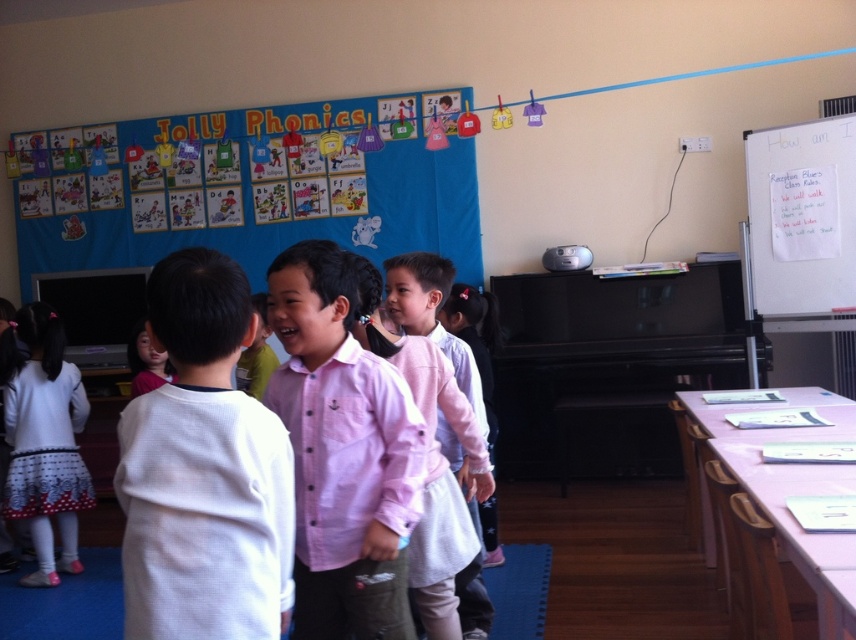
Does pink button-down shirt at center appear over pink cotton shirt at center?

Yes, pink button-down shirt at center is above pink cotton shirt at center.

Between pink button-down shirt at center and pink cotton shirt at center, which one appears on the right side from the viewer's perspective?

pink cotton shirt at center is more to the right.

This screenshot has height=640, width=856. What do you see at coordinates (343, 452) in the screenshot? I see `pink button-down shirt at center` at bounding box center [343, 452].

At what (x,y) coordinates should I click in order to perform the action: click on pink button-down shirt at center. Please return your answer as a coordinate pair (x, y). The width and height of the screenshot is (856, 640). Looking at the image, I should click on (343, 452).

Image resolution: width=856 pixels, height=640 pixels. In order to click on pink button-down shirt at center in this screenshot , I will do `click(343, 452)`.

Which is behind, point (310, 420) or point (842, 218)?

Point (842, 218)

This screenshot has width=856, height=640. In order to click on pink button-down shirt at center in this screenshot , I will do `click(343, 452)`.

Who is taller, white matte shirt at center or white paper at upper right?

Standing taller between the two is white paper at upper right.

Which is behind, point (217, 593) or point (755, 269)?

The point (755, 269) is behind.

Is point (128, 474) closer to viewer compared to point (840, 170)?

Yes, point (128, 474) is in front of point (840, 170).

Find the location of a particular element. white matte shirt at center is located at coordinates (203, 470).